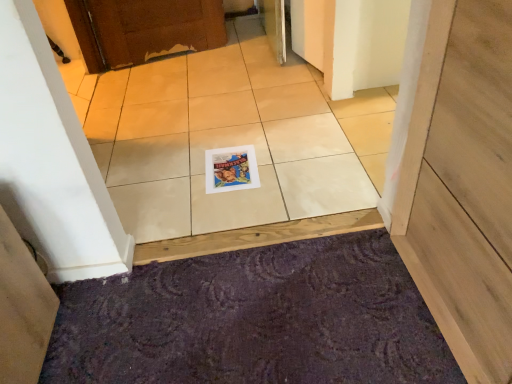
Where is `free space above matte paper magazine at center (from a real-world perspective)`? This screenshot has height=384, width=512. free space above matte paper magazine at center (from a real-world perspective) is located at coordinates (227, 161).